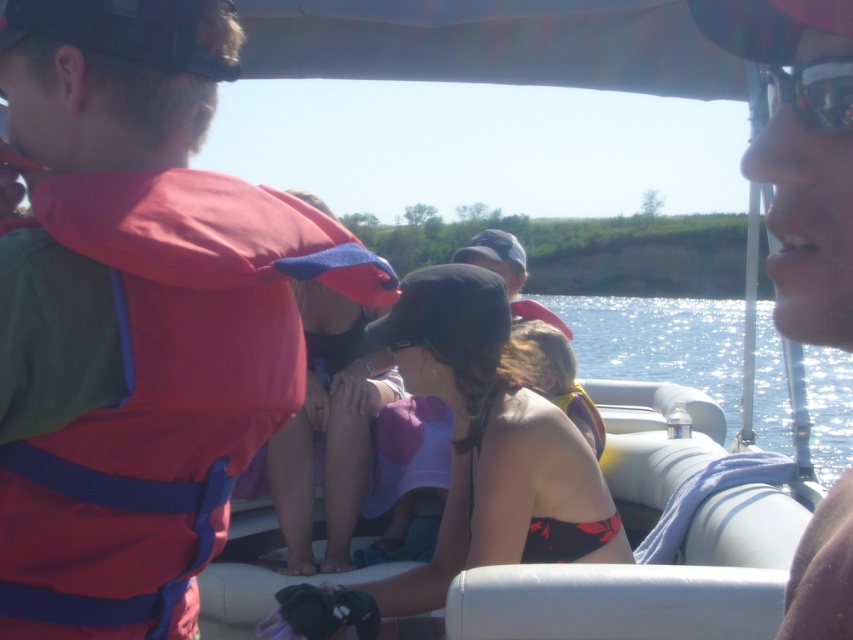
Is matte red life vest at left positioned behind black fabric hat at center?

No, matte red life vest at left is closer to the viewer.

Measure the distance between matte red life vest at left and camera.

A distance of 3.65 feet exists between matte red life vest at left and camera.

This screenshot has width=853, height=640. What are the coordinates of `matte red life vest at left` in the screenshot? It's located at (140, 314).

Who is shorter, matte red life vest at left or matte black sunglasses at upper right?

Standing shorter between the two is matte black sunglasses at upper right.

Between point (18, 307) and point (788, 310), which one is positioned in front?

Point (788, 310) is more forward.

Between point (329, 264) and point (827, 232), which one is positioned in front?

Point (827, 232)

You are a GUI agent. You are given a task and a screenshot of the screen. Output one action in this format:
    pyautogui.click(x=<x>, y=<y>)
    Task: Click on the matte red life vest at left
    The width and height of the screenshot is (853, 640).
    Given the screenshot: What is the action you would take?
    pyautogui.click(x=140, y=314)

Is the position of matte black sunglasses at upper right more distant than that of matte yellow life jacket at center?

No, it is not.

The width and height of the screenshot is (853, 640). What are the coordinates of `matte black sunglasses at upper right` in the screenshot? It's located at point(799,150).

The height and width of the screenshot is (640, 853). In order to click on matte black sunglasses at upper right in this screenshot , I will do `click(799, 150)`.